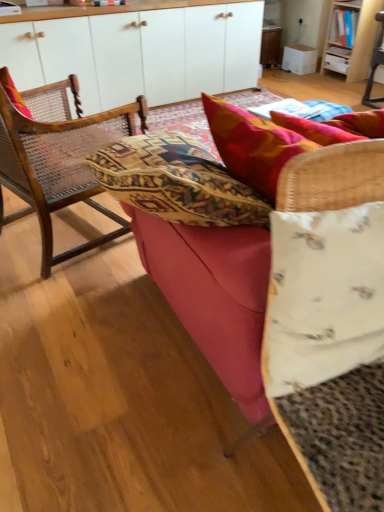
Question: From the image's perspective, is woven wood chair at left located beneath velvet red couch at center?

Choices:
 (A) yes
 (B) no

Answer: (B)

Question: Are woven wood chair at left and velvet red couch at center far apart?

Choices:
 (A) yes
 (B) no

Answer: (B)

Question: Is woven wood chair at left further to camera compared to velvet red couch at center?

Choices:
 (A) yes
 (B) no

Answer: (A)

Question: Is woven wood chair at left facing towards velvet red couch at center?

Choices:
 (A) no
 (B) yes

Answer: (A)

Question: Is woven wood chair at left positioned with its back to velvet red couch at center?

Choices:
 (A) no
 (B) yes

Answer: (A)

Question: Based on their sizes in the image, would you say textured red pillow at upper right, which is the 1th pillow in back-to-front order, is bigger or smaller than white fabric pillow at center, acting as the 1th pillow starting from the bottom?

Choices:
 (A) small
 (B) big

Answer: (B)

Question: From the image's perspective, is textured red pillow at upper right, which ranks as the 1th pillow in top-to-bottom order, located above or below white fabric pillow at center, the first pillow when ordered from front to back?

Choices:
 (A) above
 (B) below

Answer: (A)

Question: Is textured red pillow at upper right, which ranks as the 1th pillow in top-to-bottom order, to the left or to the right of white fabric pillow at center, the first pillow when ordered from front to back, in the image?

Choices:
 (A) left
 (B) right

Answer: (B)

Question: Is point (291, 116) closer or farther from the camera than point (322, 334)?

Choices:
 (A) farther
 (B) closer

Answer: (A)

Question: Does point (220, 10) appear closer or farther from the camera than point (336, 71)?

Choices:
 (A) farther
 (B) closer

Answer: (B)

Question: From the image's perspective, is white matte cabinet at upper center positioned above or below wooden bookshelf at upper right?

Choices:
 (A) above
 (B) below

Answer: (B)

Question: Is white matte cabinet at upper center situated inside wooden bookshelf at upper right or outside?

Choices:
 (A) inside
 (B) outside

Answer: (B)

Question: From their relative heights in the image, would you say white matte cabinet at upper center is taller or shorter than wooden bookshelf at upper right?

Choices:
 (A) short
 (B) tall

Answer: (B)

Question: From a real-world perspective, is textured red pillow at upper right, which ranks as the 1th pillow in top-to-bottom order, positioned above or below wooden bookshelf at upper right?

Choices:
 (A) above
 (B) below

Answer: (A)

Question: Based on their sizes in the image, would you say textured red pillow at upper right, which ranks as the second pillow in front-to-back order, is bigger or smaller than wooden bookshelf at upper right?

Choices:
 (A) small
 (B) big

Answer: (A)